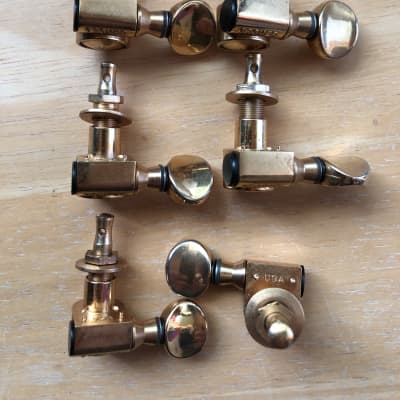
The width and height of the screenshot is (400, 400). Identify the location of table. (360, 246).